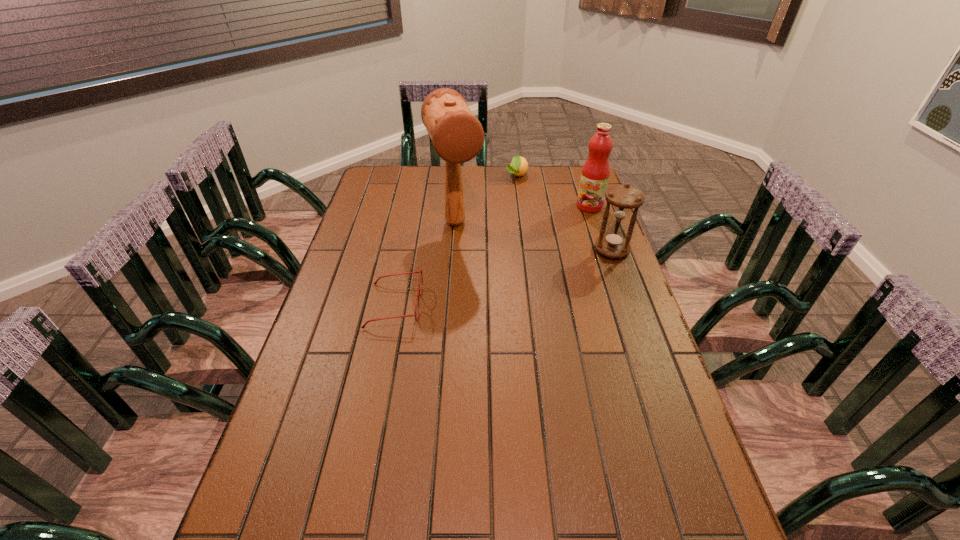
Identify the location of free space between the nearest object and the third shortest object. This screenshot has width=960, height=540. (503, 278).

Find the location of a particular element. The width and height of the screenshot is (960, 540). vacant space in between the hourglass and the third object from left to right is located at coordinates (564, 213).

This screenshot has height=540, width=960. In order to click on vacant space in between the tallest object and the shortest object in this screenshot , I will do `click(425, 264)`.

Locate an element on the screen. The width and height of the screenshot is (960, 540). free space between the nearest object and the farthest object is located at coordinates (456, 240).

Where is `free spot between the third object from right to left and the tallest object`? free spot between the third object from right to left and the tallest object is located at coordinates (486, 199).

The width and height of the screenshot is (960, 540). I want to click on free space that is in between the fruit juice and the shortest object, so click(492, 255).

Find the location of a particular element. Image resolution: width=960 pixels, height=540 pixels. unoccupied position between the fourth tallest object and the third shortest object is located at coordinates (564, 213).

Find the location of a particular element. The height and width of the screenshot is (540, 960). vacant space that's between the tallest object and the farthest object is located at coordinates (486, 199).

This screenshot has height=540, width=960. I want to click on free space that is in between the nearest object and the hourglass, so click(503, 278).

Where is `object that is the second closest to the fruit juice`? Image resolution: width=960 pixels, height=540 pixels. object that is the second closest to the fruit juice is located at coordinates click(519, 165).